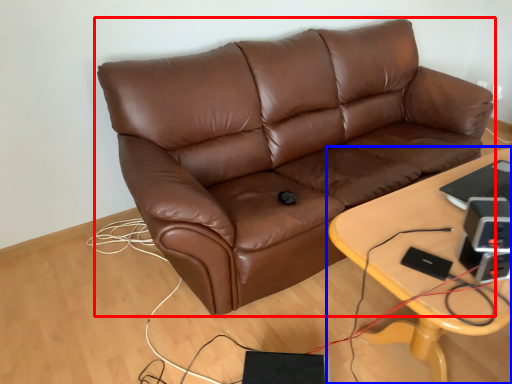
Question: Which object is further to the camera taking this photo, studio couch (highlighted by a red box) or table (highlighted by a blue box)?

Choices:
 (A) studio couch
 (B) table

Answer: (A)